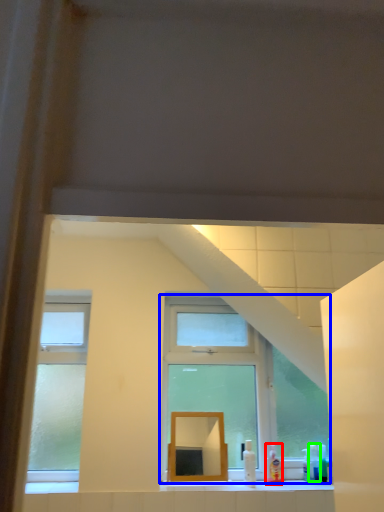
Question: Which is nearer to the toiletry (highlighted by a red box)? window (highlighted by a blue box) or toiletry (highlighted by a green box).

Choices:
 (A) window
 (B) toiletry

Answer: (B)